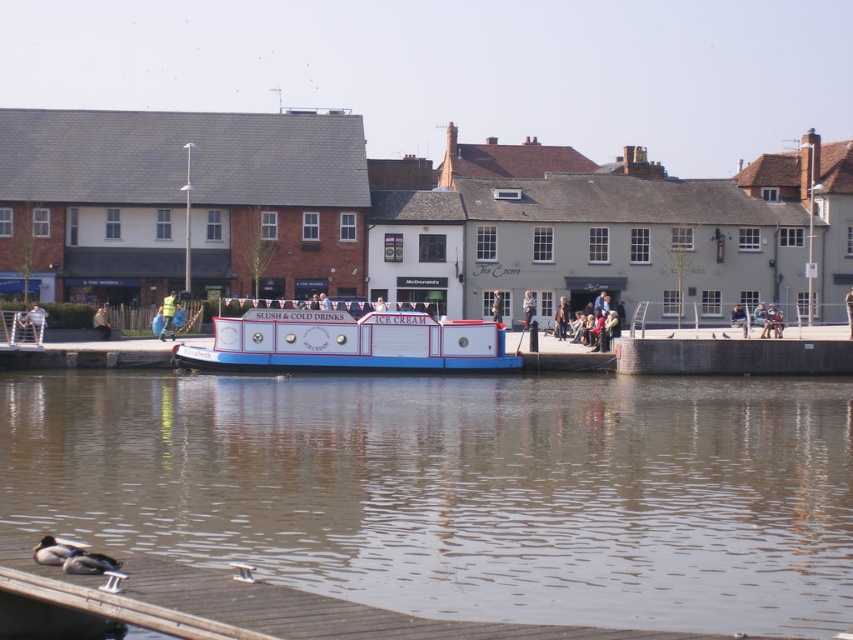
Can you confirm if light blue fabric jacket at left is positioned above light brown wooden post at center?

Incorrect, light blue fabric jacket at left is not positioned above light brown wooden post at center.

Between light blue fabric jacket at left and light brown wooden post at center, which one appears on the left side from the viewer's perspective?

light blue fabric jacket at left is more to the left.

What do you see at coordinates (32, 323) in the screenshot?
I see `light blue fabric jacket at left` at bounding box center [32, 323].

You are a GUI agent. You are given a task and a screenshot of the screen. Output one action in this format:
    pyautogui.click(x=<x>, y=<y>)
    Task: Click on the light blue fabric jacket at left
    This screenshot has height=640, width=853.
    Given the screenshot: What is the action you would take?
    pyautogui.click(x=32, y=323)

Which is above, brown wooden dock at lower left or light blue fabric jacket at left?

light blue fabric jacket at left is higher up.

Who is taller, brown wooden dock at lower left or light blue fabric jacket at left?

brown wooden dock at lower left is taller.

Between point (143, 476) and point (32, 332), which one is positioned behind?

The point (32, 332) is more distant.

At what (x,y) coordinates should I click in order to perform the action: click on brown wooden dock at lower left. Please return your answer as a coordinate pair (x, y). Looking at the image, I should click on (460, 490).

Which is above, brown wooden dock at lower left or light brown wooden post at center?

light brown wooden post at center is higher up.

Who is more distant from viewer, (x=740, y=624) or (x=521, y=307)?

The point (x=521, y=307) is behind.

Find the location of a particular element. brown wooden dock at lower left is located at coordinates (460, 490).